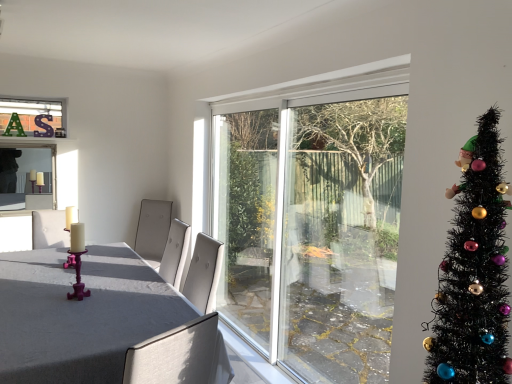
The width and height of the screenshot is (512, 384). Find the location of `vacant space situated on the left part of purple metallic candle holder at left`. vacant space situated on the left part of purple metallic candle holder at left is located at coordinates (45, 297).